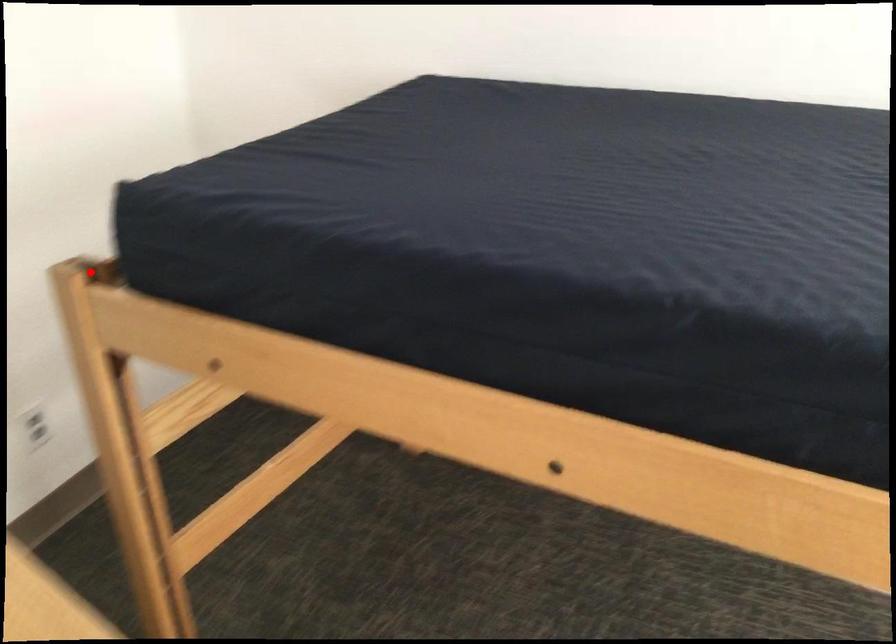
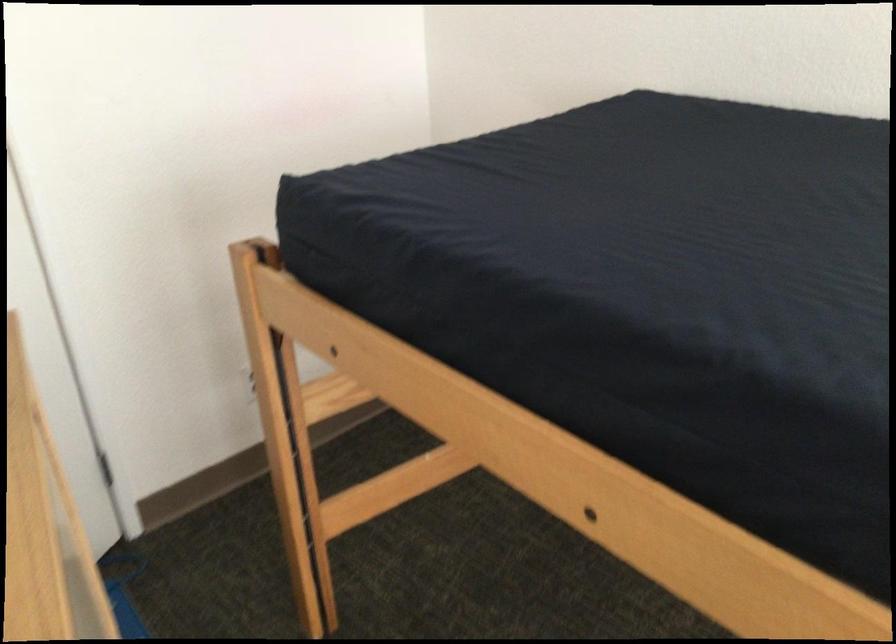
The point at the highlighted location is marked in the first image. Where is the corresponding point in the second image?

(262, 251)